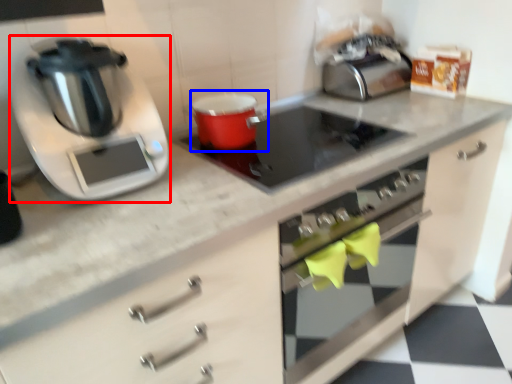
Question: Which point is further to the camera, kitchen appliance (highlighted by a red box) or appliance (highlighted by a blue box)?

Choices:
 (A) kitchen appliance
 (B) appliance

Answer: (B)